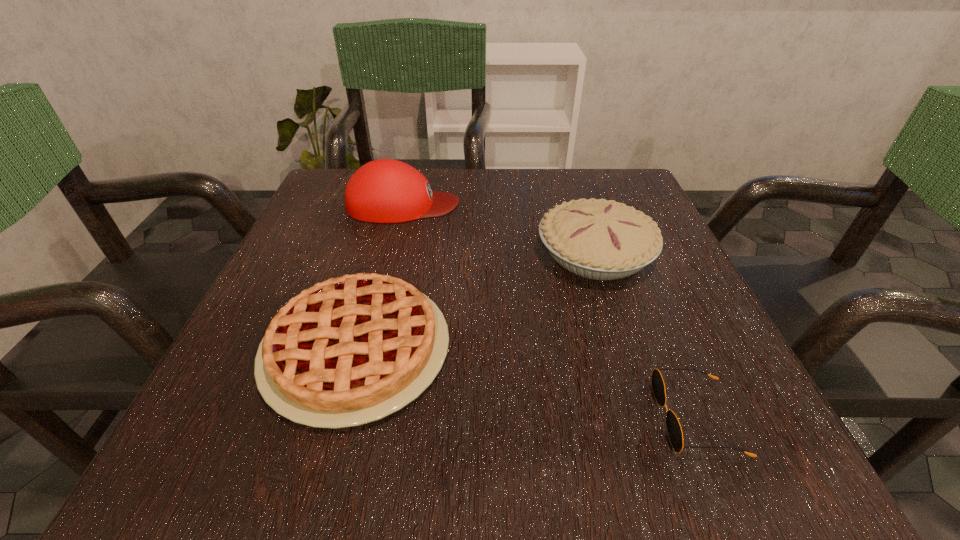
Where is `object located at the far left corner`? The width and height of the screenshot is (960, 540). object located at the far left corner is located at coordinates (385, 190).

Identify the location of object that is at the near left corner. Image resolution: width=960 pixels, height=540 pixels. (351, 350).

Where is `object that is at the far right corner`? The height and width of the screenshot is (540, 960). object that is at the far right corner is located at coordinates (598, 239).

The height and width of the screenshot is (540, 960). In order to click on object that is at the near right corner in this screenshot , I will do `click(674, 429)`.

Where is `vacant space at the far edge`? The width and height of the screenshot is (960, 540). vacant space at the far edge is located at coordinates (513, 175).

I want to click on blank space at the near edge of the desktop, so click(x=645, y=443).

In the image, there is a desktop. At what (x,y) coordinates should I click in order to perform the action: click on vacant area at the left edge. Please return your answer as a coordinate pair (x, y). Looking at the image, I should click on (359, 237).

Locate an element on the screen. free space at the right edge is located at coordinates (669, 352).

The width and height of the screenshot is (960, 540). In the image, there is a desktop. What are the coordinates of `vacant area at the far left corner` in the screenshot? It's located at (323, 190).

Locate an element on the screen. This screenshot has width=960, height=540. vacant space at the far right corner of the desktop is located at coordinates (580, 176).